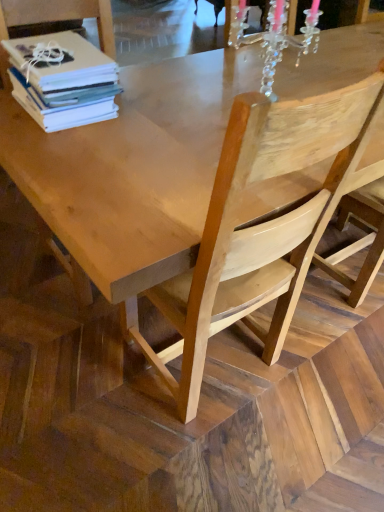
Find the location of a particular element. This screenshot has width=384, height=512. free space in front of natural wood chair at right, which ranks as the 3th chair in left-to-right order is located at coordinates (330, 338).